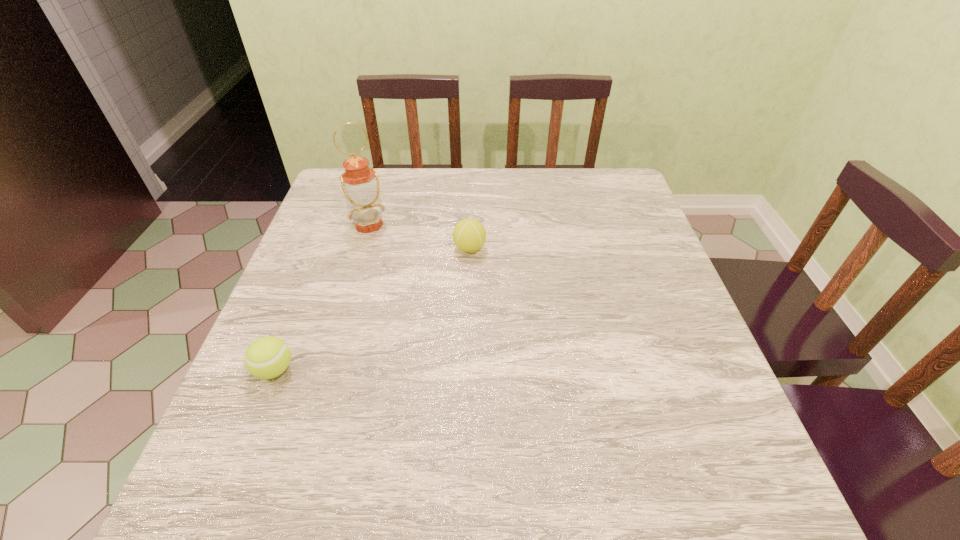
Image resolution: width=960 pixels, height=540 pixels. What are the coordinates of `oil lamp` in the screenshot? It's located at pos(360,184).

The width and height of the screenshot is (960, 540). What are the coordinates of `the farthest object` in the screenshot? It's located at (360, 184).

At what (x,y) coordinates should I click in order to perform the action: click on the farther tennis ball. Please return your answer as a coordinate pair (x, y). This screenshot has width=960, height=540. Looking at the image, I should click on (469, 235).

At what (x,y) coordinates should I click in order to perform the action: click on the right tennis ball. Please return your answer as a coordinate pair (x, y). Looking at the image, I should click on (469, 235).

You are a GUI agent. You are given a task and a screenshot of the screen. Output one action in this format:
    pyautogui.click(x=<x>, y=<y>)
    Task: Click on the nearer tennis ball
    
    Given the screenshot: What is the action you would take?
    pyautogui.click(x=267, y=357)

In order to click on the nearest object in this screenshot , I will do `click(267, 357)`.

Identify the location of blank area located 0.350m on the right of the tallest object. This screenshot has height=540, width=960. (517, 225).

Locate an element on the screen. Image resolution: width=960 pixels, height=540 pixels. free region located on the left of the right tennis ball is located at coordinates (312, 248).

Where is `vacant region located on the back of the nearer tennis ball`? The width and height of the screenshot is (960, 540). vacant region located on the back of the nearer tennis ball is located at coordinates (310, 280).

At what (x,y) coordinates should I click in order to perform the action: click on oil lamp positioned at the left edge. Please return your answer as a coordinate pair (x, y). Looking at the image, I should click on (360, 184).